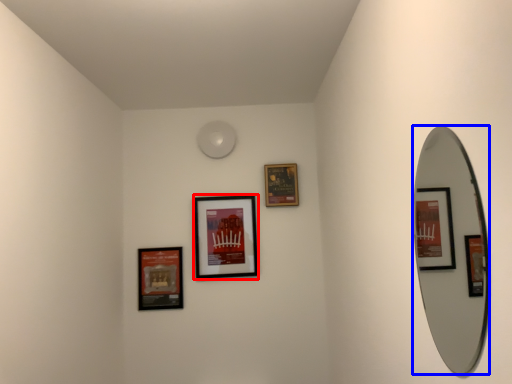
Question: Which object is further to the camera taking this photo, picture frame (highlighted by a red box) or mirror (highlighted by a blue box)?

Choices:
 (A) picture frame
 (B) mirror

Answer: (A)